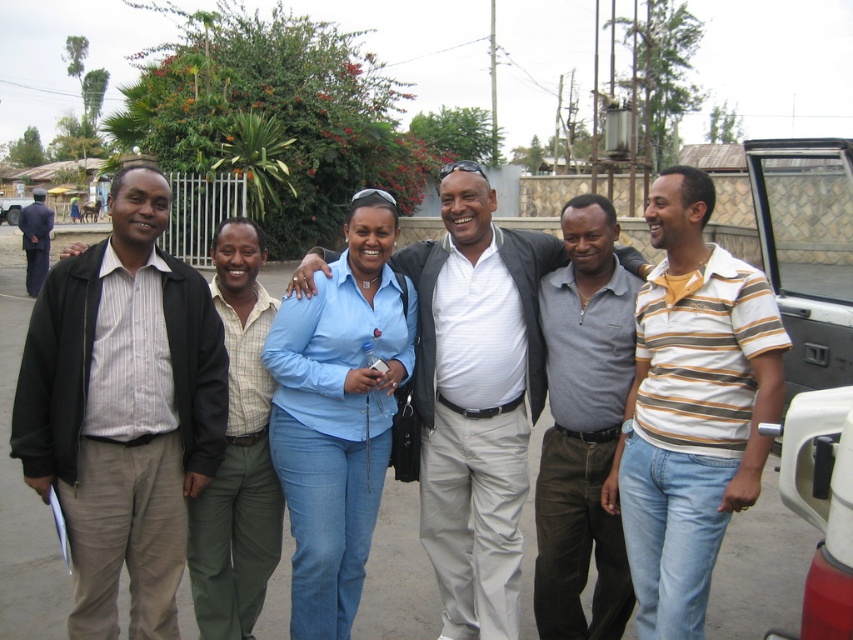
Based on the scene description, can you determine if the gray cotton shirt at center is bigger than the green cotton pants at center?

The gray cotton shirt at center has a larger size compared to green cotton pants at center, so yes, the gray cotton shirt at center is bigger than the green cotton pants at center.

You are a photographer trying to capture a clear shot of the striped fabric shirt at left and the white plastic pickup truck at right. Based on their positions, can you see both objects clearly in the frame without any obstruction?

The white plastic pickup truck at right is behind striped fabric shirt at left, so the striped fabric shirt at left will block the view of the white plastic pickup truck at right, making it partially or fully obscured in the frame.

You are a photographer adjusting your camera settings to focus on two specific points in the image. The first point is labeled as point (114, 189) and the second is point (653, 572). Since you can only focus on one point at a time, which point should you choose to ensure the foreground subject is sharp?

Point (114, 189) is further to the viewer than point (653, 572), so you should focus on point (114, 189) to ensure the foreground subject is sharp.